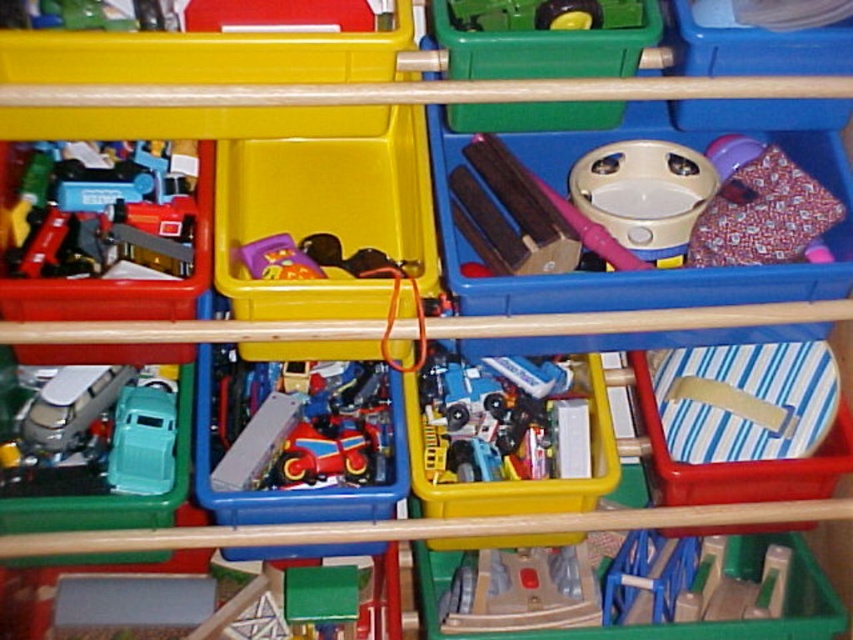
Locate an element on the screen. The image size is (853, 640). red fabric bag at upper right is located at coordinates (759, 209).

Can you confirm if red fabric bag at upper right is positioned to the right of rubberized plastic toy car at center?

Yes, red fabric bag at upper right is to the right of rubberized plastic toy car at center.

Does point (743, 211) come closer to viewer compared to point (263, 243)?

No, (743, 211) is further to viewer.

Identify the location of red fabric bag at upper right. (759, 209).

Does shiny blue car at center have a greater height compared to red fabric bag at upper right?

No, shiny blue car at center is not taller than red fabric bag at upper right.

Where is `shiny blue car at center`? Image resolution: width=853 pixels, height=640 pixels. shiny blue car at center is located at coordinates coord(502,419).

Looking at this image, who is more forward, (433, 449) or (722, 180)?

Point (433, 449) is in front.

You are a GUI agent. You are given a task and a screenshot of the screen. Output one action in this format:
    pyautogui.click(x=<x>, y=<y>)
    Task: Click on the shiny blue car at center
    
    Given the screenshot: What is the action you would take?
    pyautogui.click(x=502, y=419)

Is matte plastic toy car at left below matte silver van at left?

No, matte plastic toy car at left is not below matte silver van at left.

Identify the location of matte plastic toy car at left. The height and width of the screenshot is (640, 853). [103, 209].

At what (x,y) coordinates should I click in order to perform the action: click on matte plastic toy car at left. Please return your answer as a coordinate pair (x, y). This screenshot has height=640, width=853. Looking at the image, I should click on (103, 209).